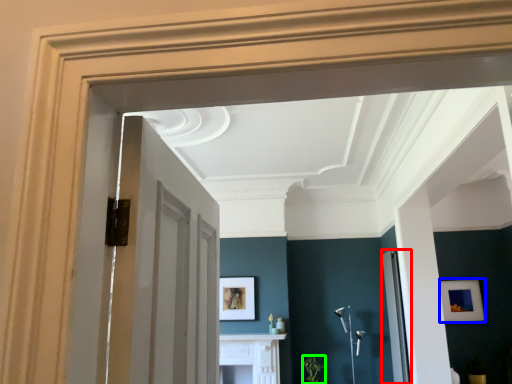
Question: Estimate the real-world distances between objects in this image. Which object is farther from glass door (highlighted by a red box), picture frame (highlighted by a blue box) or plant (highlighted by a green box)?

Choices:
 (A) picture frame
 (B) plant

Answer: (A)